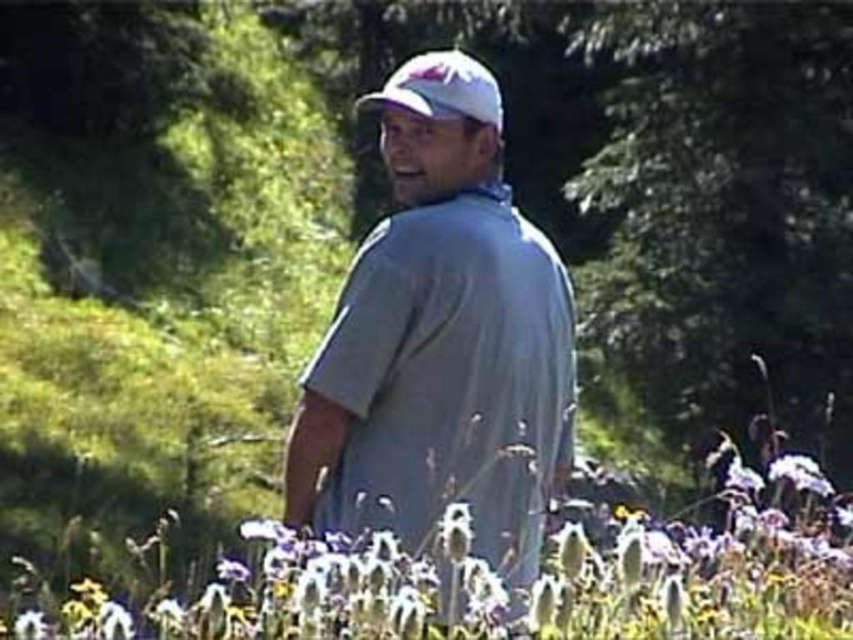
A photographer wants to take a picture of the man and the point at position (463, 451). The camera has a maximum focus range of 3 meters. Will both subjects be in focus?

The distance between the man and the point at position (463, 451) is 3.95 meters, which exceeds the camera maximum focus range of 3 meters. Therefore, both subjects cannot be in focus at the same time.

You are a photographer trying to capture the man in the gray cotton shirt at center. You are standing at point (440, 340). Can you see the man clearly?

Yes, the gray cotton shirt at center is located at point (440, 340), so you are standing exactly where the man is positioned. Therefore, you cannot see him clearly as you are in the same location.

You are a photographer standing in a meadow with a white fluffy flower at center. You want to take a photo of the flower but need to be exactly 3 meters away for the perfect shot. Are you currently positioned correctly?

The distance of white fluffy flower at center from camera is 2.96 meters, which is slightly less than 3 meters. To achieve the desired distance, you should move back approximately 4 centimeters.